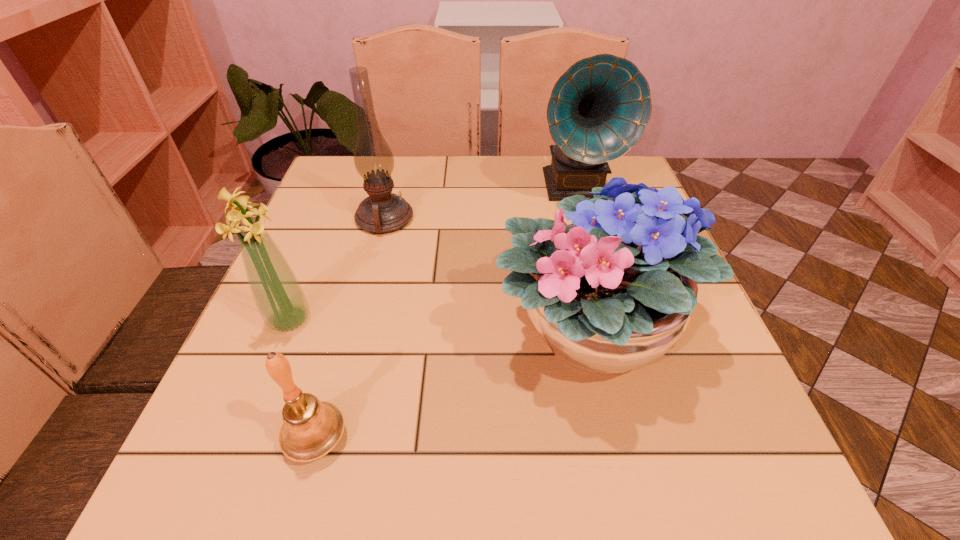
The width and height of the screenshot is (960, 540). Identify the location of object present at the far right corner. [599, 108].

In the image, there is a desktop. Identify the location of free space at the far edge. (531, 156).

Locate an element on the screen. This screenshot has width=960, height=540. blank area at the left edge is located at coordinates (319, 221).

What are the coordinates of `vacant area at the right edge` in the screenshot? It's located at (652, 392).

At what (x,y) coordinates should I click in order to perform the action: click on vacant space at the near left corner of the desktop. Please return your answer as a coordinate pair (x, y). The image size is (960, 540). Looking at the image, I should click on (221, 450).

The image size is (960, 540). Identify the location of vacant region at the far right corner of the desktop. (611, 178).

Where is `empty space between the oil lamp and the leftmost object`? The image size is (960, 540). empty space between the oil lamp and the leftmost object is located at coordinates (337, 269).

You are a GUI agent. You are given a task and a screenshot of the screen. Output one action in this format:
    pyautogui.click(x=<x>, y=<y>)
    Task: Click on the empty space that is in between the oil lamp and the right bouquet
    The image size is (960, 540).
    Given the screenshot: What is the action you would take?
    pyautogui.click(x=488, y=275)

Locate an element on the screen. blank region between the bell and the right bouquet is located at coordinates (453, 386).

This screenshot has width=960, height=540. Find the location of `free area in between the right bouquet and the oil lamp`. free area in between the right bouquet and the oil lamp is located at coordinates (488, 275).